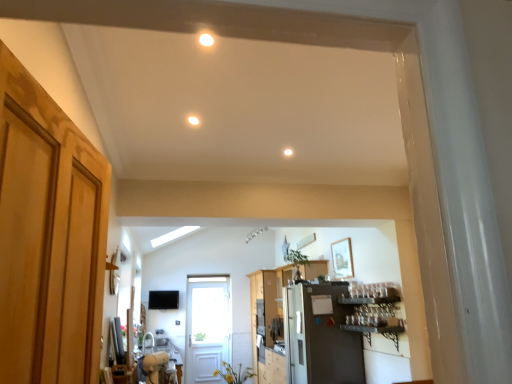
This screenshot has width=512, height=384. Find the location of `free space to the back side of white glossy light fixture at upper center, acting as the second lighting starting from the left`. free space to the back side of white glossy light fixture at upper center, acting as the second lighting starting from the left is located at coordinates (208, 61).